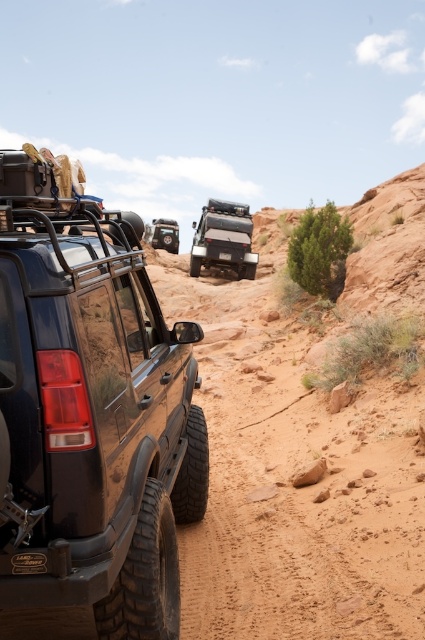
Question: Is matte black tire at center smaller than black plastic license plate at center?

Choices:
 (A) no
 (B) yes

Answer: (A)

Question: Considering the relative positions of matte black suv at left and matte black jeep at center in the image provided, where is matte black suv at left located with respect to matte black jeep at center?

Choices:
 (A) left
 (B) right

Answer: (A)

Question: Can you confirm if matte black jeep at center is positioned to the left of black plastic license plate at center?

Choices:
 (A) no
 (B) yes

Answer: (A)

Question: Which object appears closest to the camera in this image?

Choices:
 (A) matte black jeep at center
 (B) matte black tire at center
 (C) black plastic license plate at center
 (D) matte black suv at left

Answer: (D)

Question: Among these points, which one is nearest to the camera?

Choices:
 (A) (159, 241)
 (B) (51, 422)
 (C) (226, 252)
 (D) (220, 205)

Answer: (B)

Question: Among these points, which one is farthest from the camera?

Choices:
 (A) (161, 224)
 (B) (167, 513)

Answer: (A)